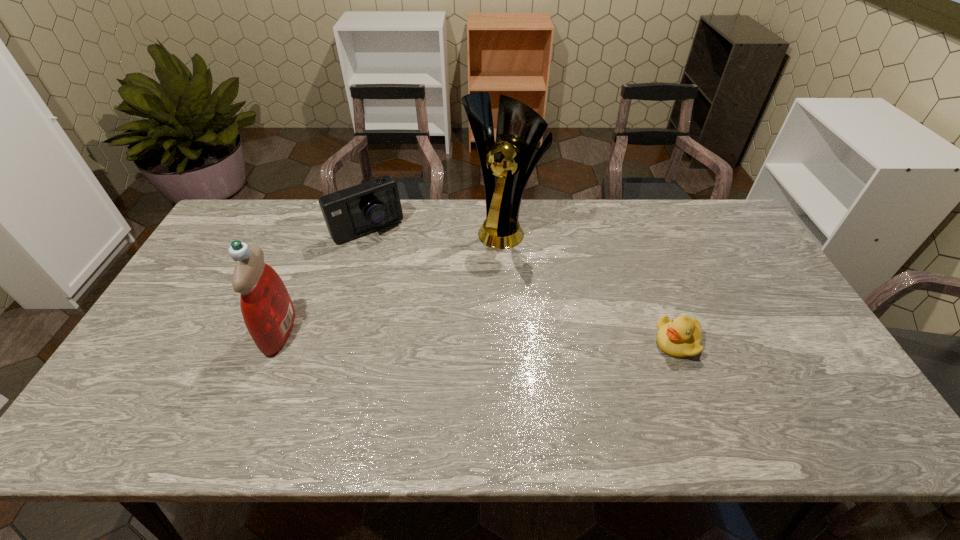
This screenshot has height=540, width=960. In the image, there is a desktop. Identify the location of vacant space at the far edge. 373,237.

Locate an element on the screen. This screenshot has height=540, width=960. free space at the left edge is located at coordinates (205, 258).

In the image, there is a desktop. Identify the location of free region at the far right corner. The width and height of the screenshot is (960, 540). (717, 241).

This screenshot has width=960, height=540. Identify the location of free spot between the rightmost object and the second tallest object. (478, 337).

The height and width of the screenshot is (540, 960). In order to click on free space between the second shortest object and the shortest object in this screenshot , I will do `click(522, 286)`.

Find the location of a particular element. free spot between the detergent and the second shortest object is located at coordinates (324, 280).

This screenshot has width=960, height=540. What are the coordinates of `empty location between the rightmost object and the tallest object` in the screenshot? It's located at (589, 285).

Locate an element on the screen. free spot between the detergent and the camera is located at coordinates (324, 280).

Where is `vacant area that lies between the detergent and the award`? vacant area that lies between the detergent and the award is located at coordinates (391, 280).

At what (x,y) coordinates should I click in order to perform the action: click on free space between the duckling and the second shortest object. Please return your answer as a coordinate pair (x, y). Looking at the image, I should click on (522, 286).